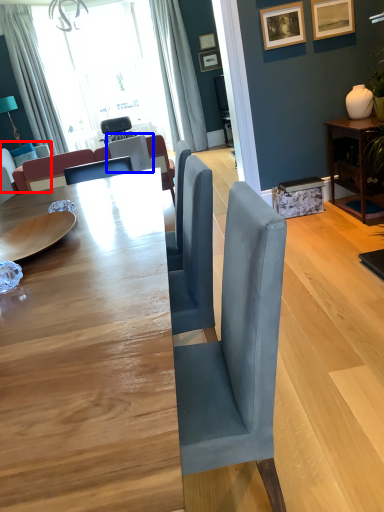
Question: Which of the following is the closest to the observer, couch (highlighted by a red box) or chair (highlighted by a blue box)?

Choices:
 (A) couch
 (B) chair

Answer: (B)